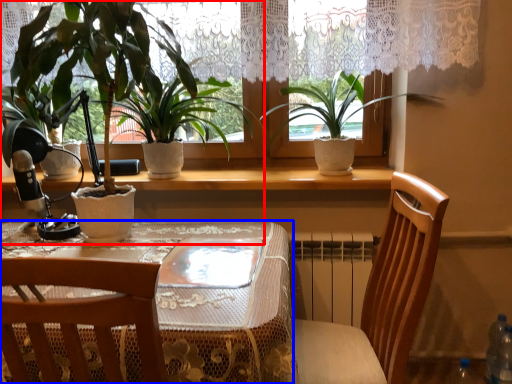
Question: Which point is further to the camera, houseplant (highlighted by a red box) or table (highlighted by a blue box)?

Choices:
 (A) houseplant
 (B) table

Answer: (A)